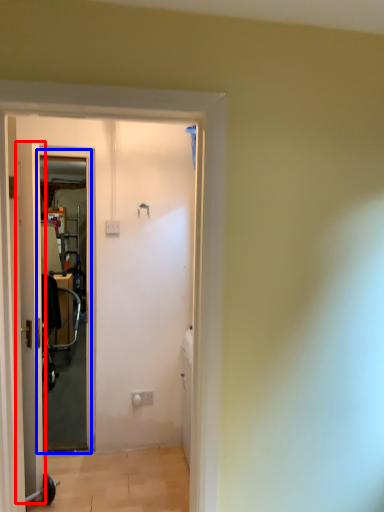
Question: Among these objects, which one is farthest to the camera, door (highlighted by a red box) or screen door (highlighted by a blue box)?

Choices:
 (A) door
 (B) screen door

Answer: (B)